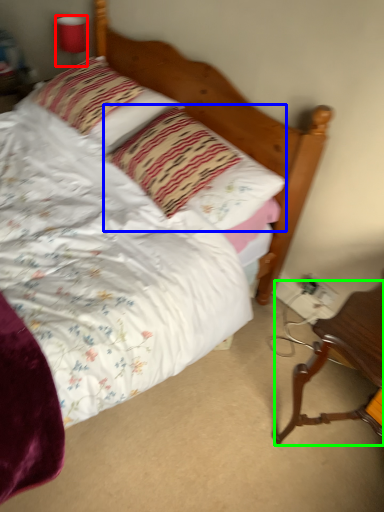
Question: Which object is positioned closest to lamp (highlighted by a red box)? Select from pillow (highlighted by a blue box) and desk (highlighted by a green box).

Choices:
 (A) pillow
 (B) desk

Answer: (A)